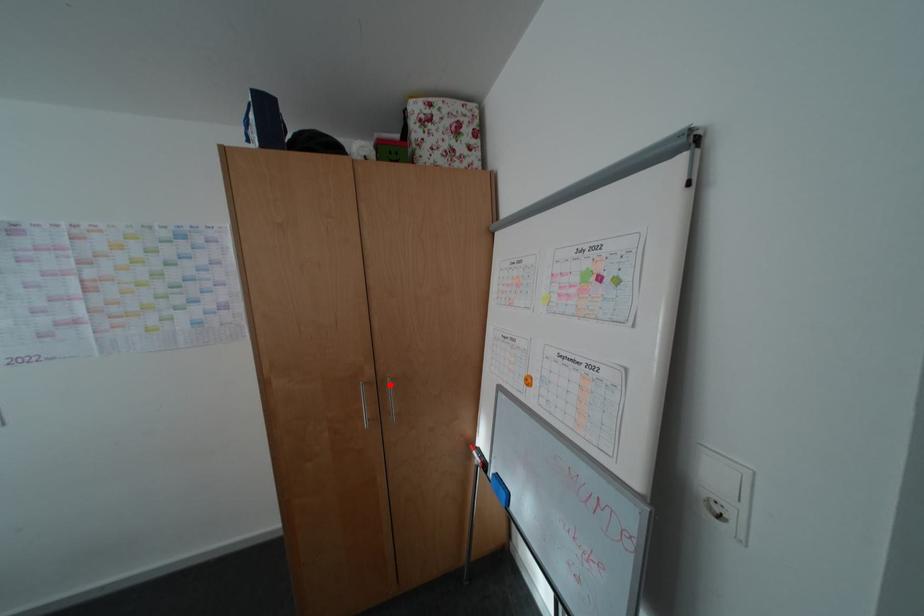
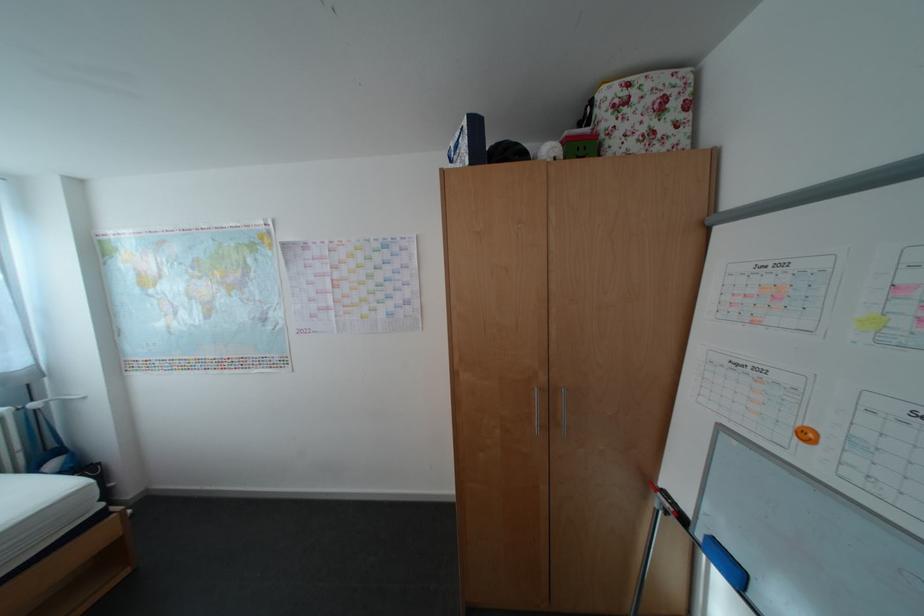
In the second image, find the point that corresponds to the highlighted location in the first image.

(562, 392)